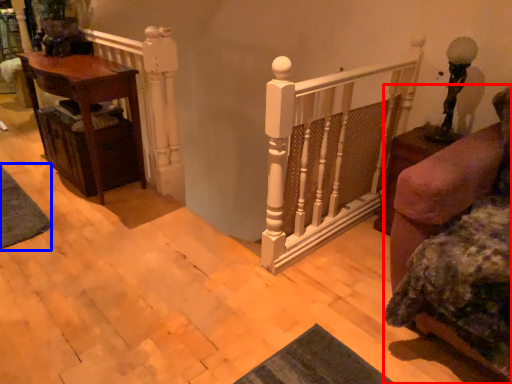
Question: Which of the following is the closest to the observer, furniture (highlighted by a red box) or mat (highlighted by a blue box)?

Choices:
 (A) furniture
 (B) mat

Answer: (A)